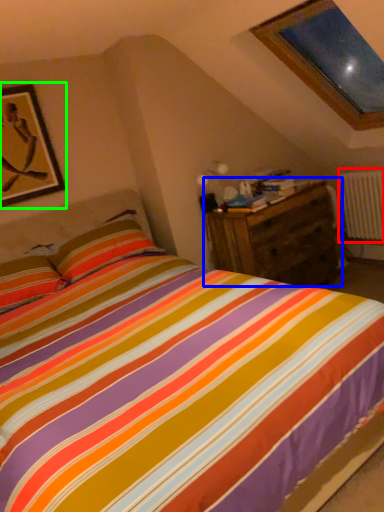
Question: Based on their relative distances, which object is farther from radiator (highlighted by a red box)? Choose from nightstand (highlighted by a blue box) and picture frame (highlighted by a green box).

Choices:
 (A) nightstand
 (B) picture frame

Answer: (B)